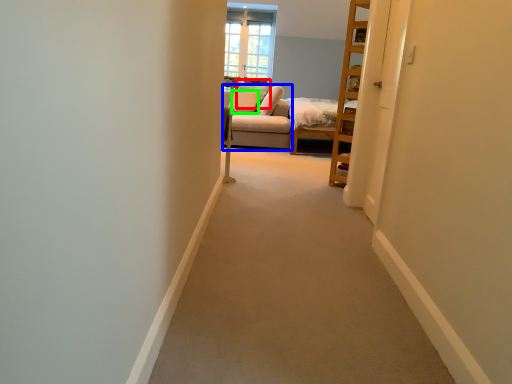
Question: Which is nearer to the pillow (highlighted by a red box)? couch (highlighted by a blue box) or pillow (highlighted by a green box).

Choices:
 (A) couch
 (B) pillow

Answer: (B)